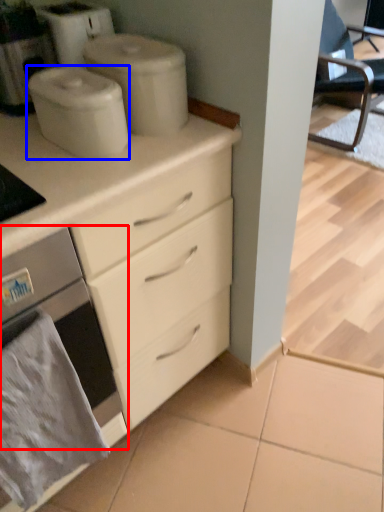
Question: Which point is closer to the camera, home appliance (highlighted by a red box) or appliance (highlighted by a blue box)?

Choices:
 (A) home appliance
 (B) appliance

Answer: (A)